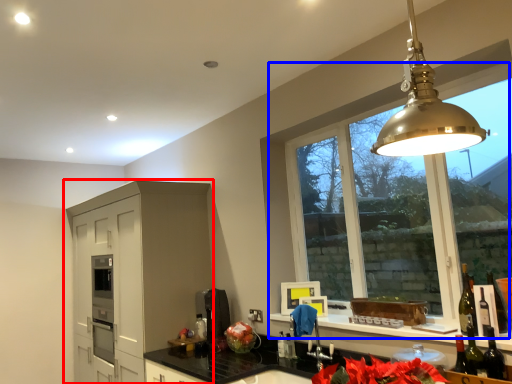
Question: Which object appears farthest to the camera in this image, cabinetry (highlighted by a red box) or window (highlighted by a blue box)?

Choices:
 (A) cabinetry
 (B) window

Answer: (A)